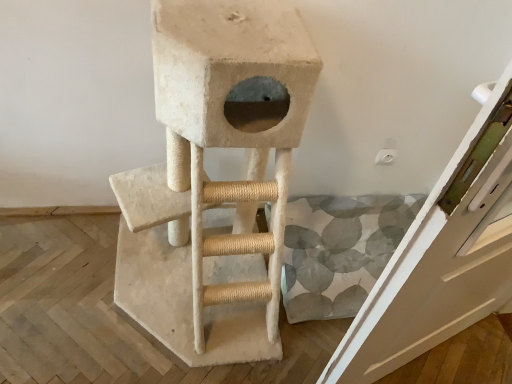
The width and height of the screenshot is (512, 384). What are the coordinates of `free point below beige felt cat tree at center (from a real-world perspective)` in the screenshot? It's located at (169, 294).